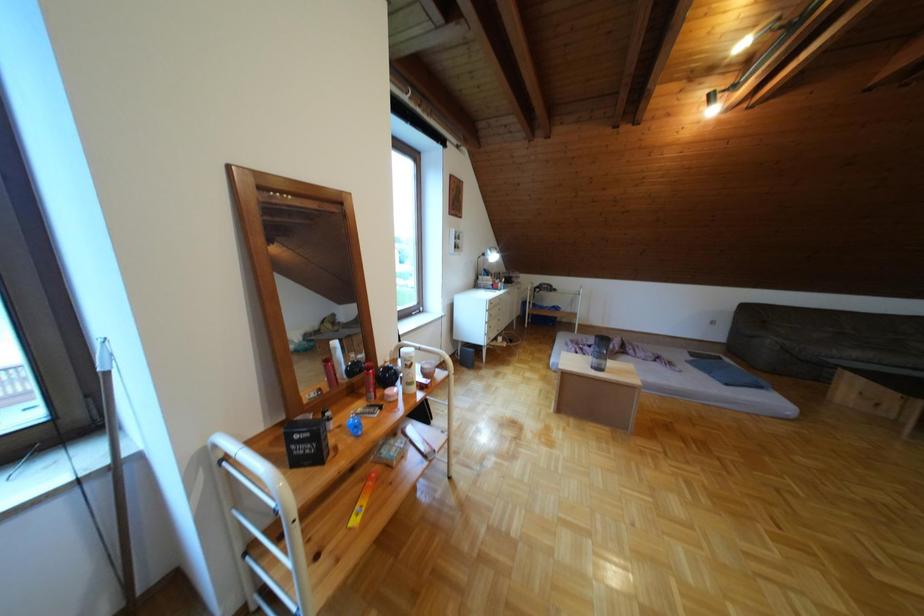
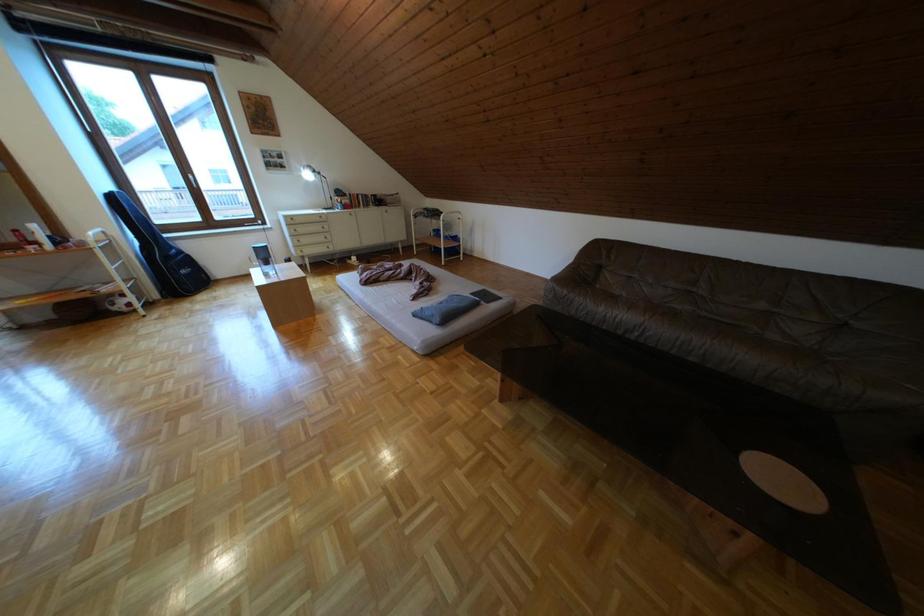
Question: Which direction would the cameraman need to move to produce the second image? Reply with the corresponding letter.

Choices:
 (A) Left
 (B) Right
 (C) Forward
 (D) Backward

Answer: (B)